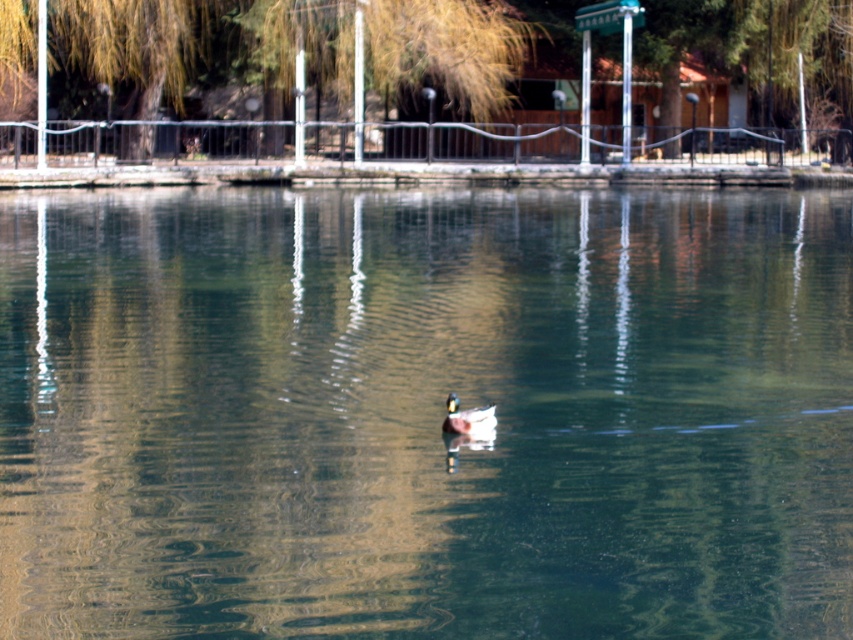
Is clear water at duck center wider than green glossy duck at center?

Yes, clear water at duck center is wider than green glossy duck at center.

Who is positioned more to the left, clear water at duck center or green glossy duck at center?

From the viewer's perspective, green glossy duck at center appears more on the left side.

Where is `clear water at duck center`? clear water at duck center is located at coordinates (425, 413).